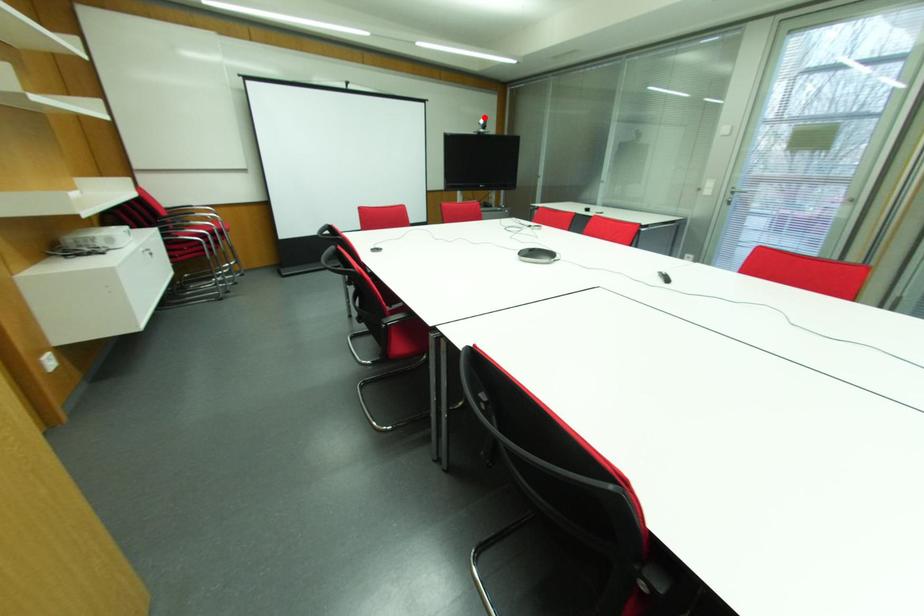
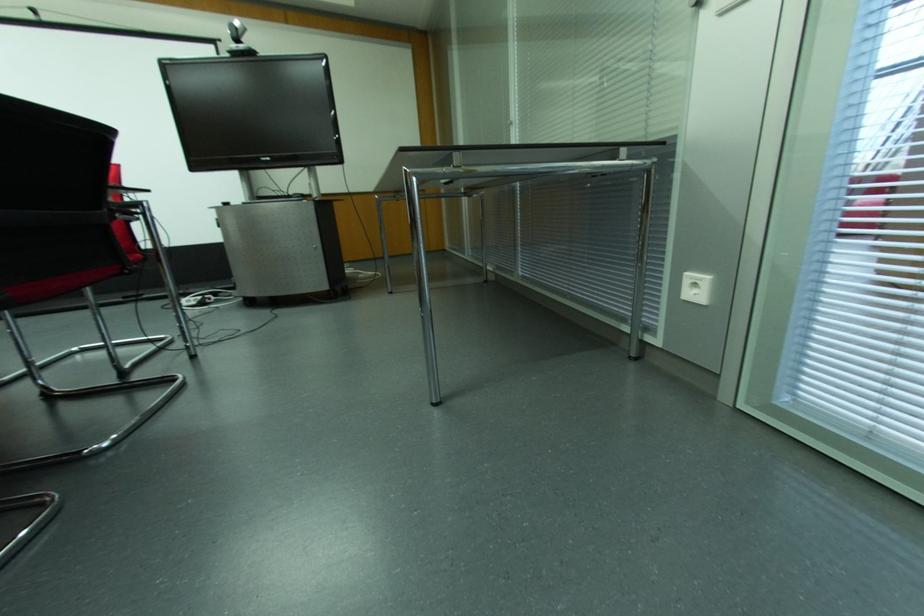
Find the pixel in the second image that matches the highlighted location in the first image.

(237, 23)